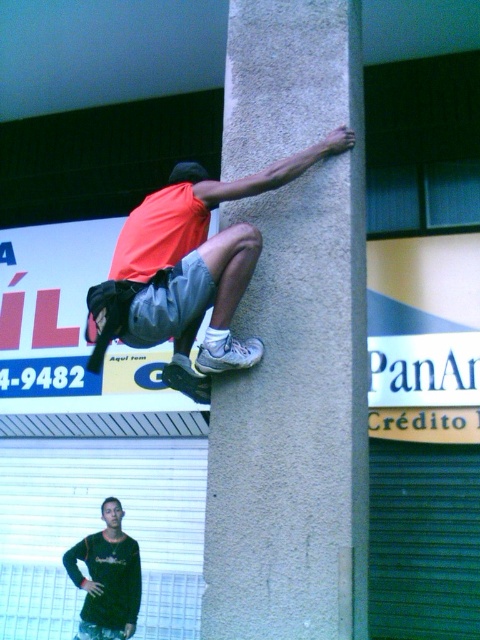
Does gray concrete pillar at center have a larger size compared to orange fabric skateboard at upper center?

Yes, gray concrete pillar at center is bigger than orange fabric skateboard at upper center.

Who is more forward, (286, 522) or (112, 323)?

Positioned in front is point (286, 522).

You are a GUI agent. You are given a task and a screenshot of the screen. Output one action in this format:
    pyautogui.click(x=<x>, y=<y>)
    Task: Click on the gray concrete pillar at center
    Image resolution: width=480 pixels, height=640 pixels.
    Given the screenshot: What is the action you would take?
    pyautogui.click(x=292, y=340)

Who is positioned more to the right, gray concrete pillar at center or black matte shirt at lower left?

gray concrete pillar at center

Describe the element at coordinates (292, 340) in the screenshot. This screenshot has height=640, width=480. I see `gray concrete pillar at center` at that location.

Find the location of a particular element. gray concrete pillar at center is located at coordinates (292, 340).

Is orange fabric skateboard at upper center closer to camera compared to black matte shirt at lower left?

Yes, orange fabric skateboard at upper center is closer to the viewer.

Is point (183, 176) positioned after point (112, 604)?

No.

Is point (260, 349) positioned in front of point (103, 579)?

Yes, it is.

The image size is (480, 640). I want to click on orange fabric skateboard at upper center, so click(x=190, y=269).